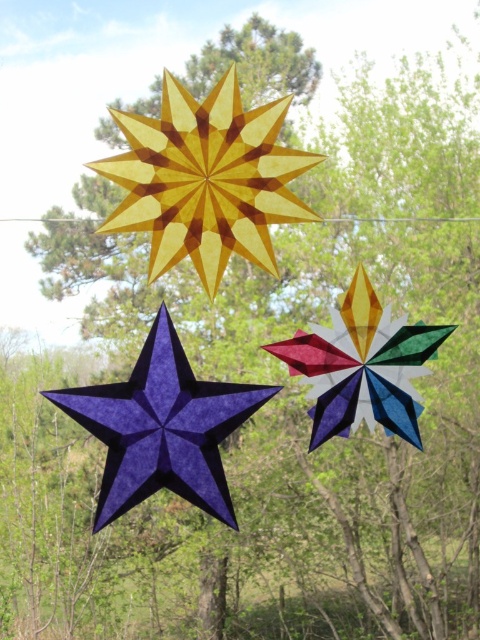
Between yellow paper star at upper center and matte purple paper star at center, which one is positioned lower?

matte purple paper star at center is lower down.

Is yellow paper star at upper center to the left of matte purple paper star at center from the viewer's perspective?

No, yellow paper star at upper center is not to the left of matte purple paper star at center.

Which is behind, point (280, 221) or point (178, 394)?

The point (280, 221) is more distant.

At what (x,y) coordinates should I click in order to perform the action: click on yellow paper star at upper center. Please return your answer as a coordinate pair (x, y). This screenshot has height=640, width=480. Looking at the image, I should click on (205, 179).

Is point (122, 204) farther from camera compared to point (423, 340)?

No, (122, 204) is in front of (423, 340).

Is point (173, 186) positioned in front of point (335, 321)?

That is True.

This screenshot has width=480, height=640. What do you see at coordinates (205, 179) in the screenshot?
I see `yellow paper star at upper center` at bounding box center [205, 179].

Find the location of a particular element. The height and width of the screenshot is (640, 480). yellow paper star at upper center is located at coordinates (205, 179).

Does matte purple paper star at center have a greater height compared to multicolored paper star at center?

Yes, matte purple paper star at center is taller than multicolored paper star at center.

Who is shorter, matte purple paper star at center or multicolored paper star at center?

With less height is multicolored paper star at center.

Who is more distant from viewer, (x=163, y=428) or (x=333, y=332)?

The point (x=333, y=332) is more distant.

Find the location of `matte purple paper star at center`. matte purple paper star at center is located at coordinates pos(162,428).